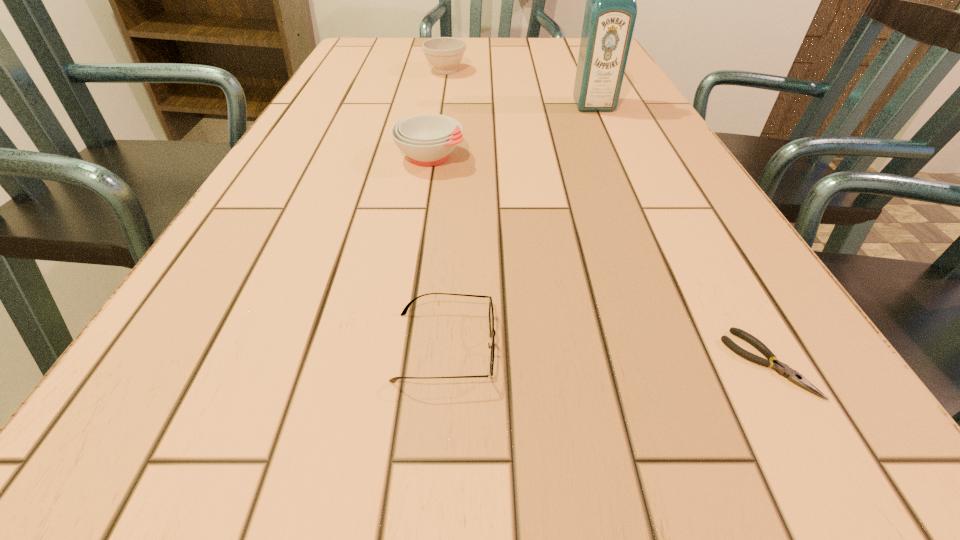
The width and height of the screenshot is (960, 540). What are the coordinates of `vacant region located on the back of the pliers` in the screenshot? It's located at (715, 270).

Locate an element on the screen. object that is at the far edge is located at coordinates (443, 53).

Where is `liquor that is at the right edge`? liquor that is at the right edge is located at coordinates (610, 13).

Locate an element on the screen. The height and width of the screenshot is (540, 960). pliers present at the right edge is located at coordinates (782, 369).

In the image, there is a desktop. In order to click on vacant area at the far edge in this screenshot , I will do `click(417, 58)`.

The height and width of the screenshot is (540, 960). In the image, there is a desktop. In order to click on free region at the left edge in this screenshot , I will do `click(275, 266)`.

Image resolution: width=960 pixels, height=540 pixels. I want to click on vacant area at the right edge of the desktop, so click(666, 250).

What are the coordinates of `vacant space at the far left corner of the desktop` in the screenshot? It's located at pyautogui.click(x=345, y=57).

Locate an element on the screen. The image size is (960, 540). unoccupied area between the fourth nearest object and the nearer soup bowl is located at coordinates (512, 131).

Where is `free point between the spectacles and the liquor`? free point between the spectacles and the liquor is located at coordinates (519, 226).